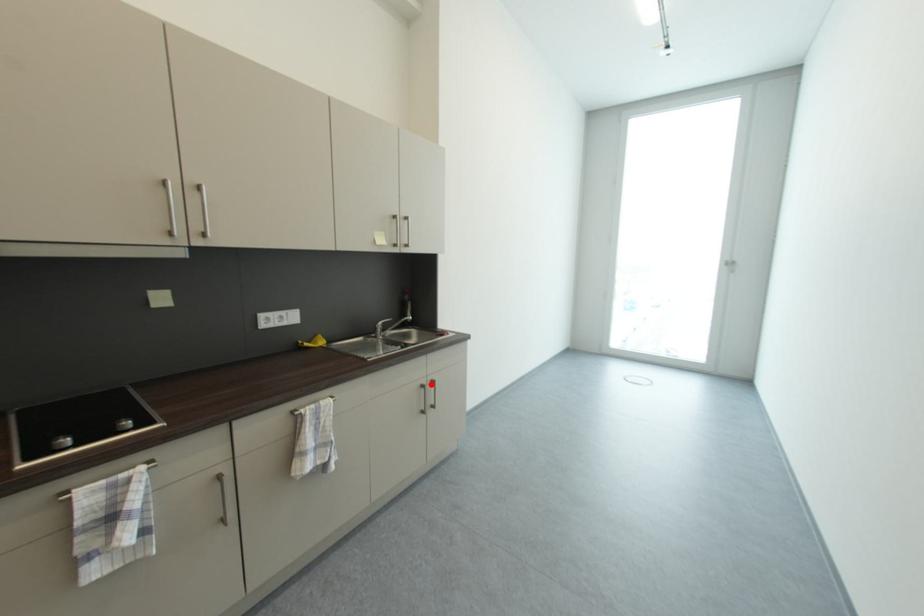
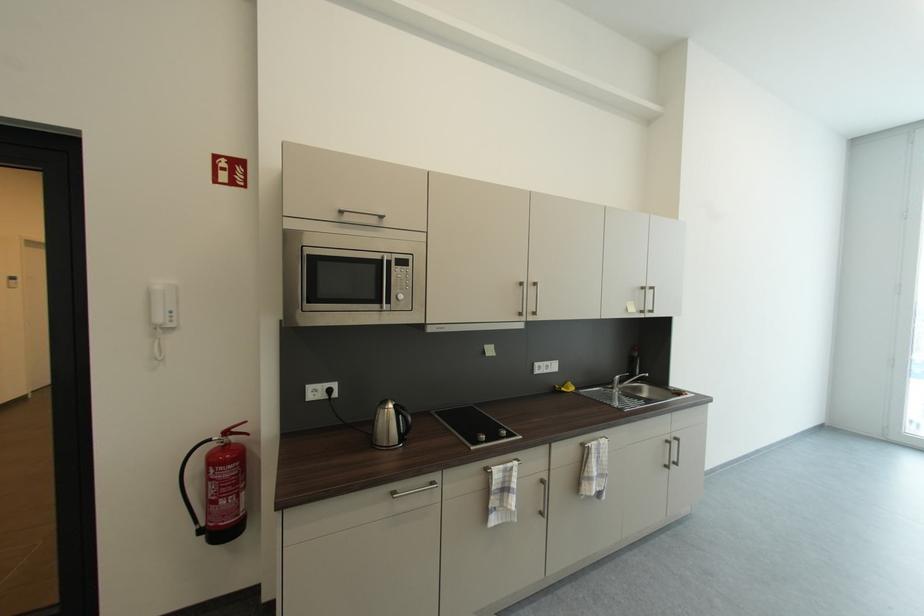
In the second image, find the point that corresponds to the highlighted location in the first image.

(675, 440)